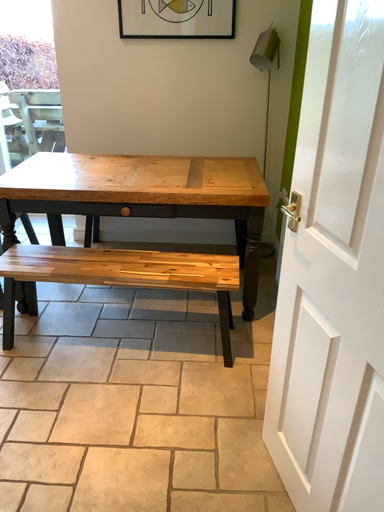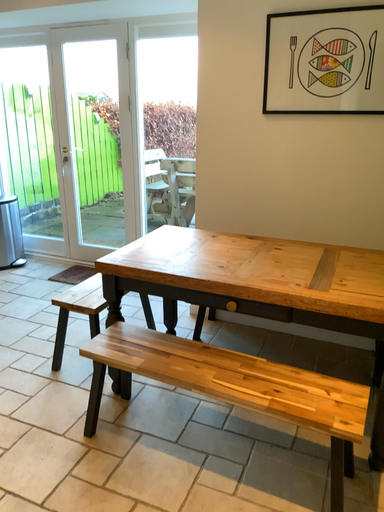
Question: Which way did the camera rotate in the video?

Choices:
 (A) rotated upward
 (B) rotated downward

Answer: (A)